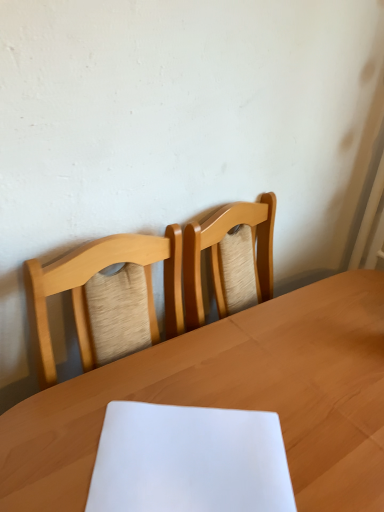
What is the approximate width of white paper at center?

white paper at center is 10.22 inches wide.

Image resolution: width=384 pixels, height=512 pixels. Find the location of `white paper at center`. white paper at center is located at coordinates (189, 460).

This screenshot has height=512, width=384. What do you see at coordinates (189, 460) in the screenshot?
I see `white paper at center` at bounding box center [189, 460].

Describe the element at coordinates (231, 398) in the screenshot. Image resolution: width=384 pixels, height=512 pixels. I see `light wood table at center` at that location.

In order to face light wood table at center, should I rotate leftwards or rightwards?

A 11.646 degree turn to the right will do.

Where is `light wood table at center`? Image resolution: width=384 pixels, height=512 pixels. light wood table at center is located at coordinates (231, 398).

Locate an element on the screen. Image resolution: width=384 pixels, height=512 pixels. white paper at center is located at coordinates (189, 460).

Considering the relative positions of white paper at center and light wood table at center in the image provided, is white paper at center to the left or to the right of light wood table at center?

white paper at center is positioned on light wood table at center's left side.

Is white paper at center further to camera compared to light wood table at center?

Yes, the depth of white paper at center is greater than that of light wood table at center.

Does point (125, 435) appear closer or farther from the camera than point (15, 407)?

Point (125, 435).

From the picture: From the image's perspective, is white paper at center under light wood table at center?

No.

From a real-world perspective, is white paper at center positioned under light wood table at center based on gravity?

No.

Can you confirm if white paper at center is wider than light wood table at center?

In fact, white paper at center might be narrower than light wood table at center.

Looking at this image, which of these two, white paper at center or light wood table at center, stands shorter?

white paper at center.

Is white paper at center smaller than light wood table at center?

Yes, white paper at center is smaller than light wood table at center.

Is white paper at center located outside light wood table at center?

That's incorrect, white paper at center is not completely outside light wood table at center.

Is white paper at center touching light wood table at center?

No, white paper at center is not with light wood table at center.

Is white paper at center oriented away from light wood table at center?

Yes, light wood table at center is at the back of white paper at center.

At what (x,y) coordinates should I click in order to perform the action: click on table that is under the white paper at center (from a real-world perspective). Please return your answer as a coordinate pair (x, y). The width and height of the screenshot is (384, 512). Looking at the image, I should click on (231, 398).

Based on their positions, is light wood table at center located to the left or right of white paper at center?

light wood table at center is positioned on white paper at center's right side.

Is light wood table at center in front of or behind white paper at center in the image?

Visually, light wood table at center is located in front of white paper at center.

Does point (228, 387) appear closer or farther from the camera than point (196, 477)?

Point (228, 387) is positioned farther from the camera compared to point (196, 477).

From the image's perspective, would you say light wood table at center is shown under white paper at center?

Indeed, from the image's perspective, light wood table at center is shown beneath white paper at center.

From a real-world perspective, relative to white paper at center, is light wood table at center vertically above or below?

light wood table at center is below white paper at center.

Looking at this image, can you confirm if light wood table at center is thinner than white paper at center?

No, light wood table at center is not thinner than white paper at center.

Can you confirm if light wood table at center is shorter than white paper at center?

No.

Can you confirm if light wood table at center is smaller than white paper at center?

No.

Based on the photo, is light wood table at center not within white paper at center?

light wood table at center is positioned outside white paper at center.

Is light wood table at center not close to white paper at center?

No.

Is light wood table at center facing away from white paper at center?

That's not correct — light wood table at center is not looking away from white paper at center.

What's the angular difference between light wood table at center and white paper at center's facing directions?

36.8 degrees.

Measure the distance from light wood table at center to white paper at center.

A distance of 4.69 inches exists between light wood table at center and white paper at center.

Locate an element on the screen. The width and height of the screenshot is (384, 512). notebook above the light wood table at center (from a real-world perspective) is located at coordinates (189, 460).

Locate an element on the screen. The height and width of the screenshot is (512, 384). notebook that is behind the light wood table at center is located at coordinates (189, 460).

Where is `table to the right of white paper at center`? The width and height of the screenshot is (384, 512). table to the right of white paper at center is located at coordinates (231, 398).